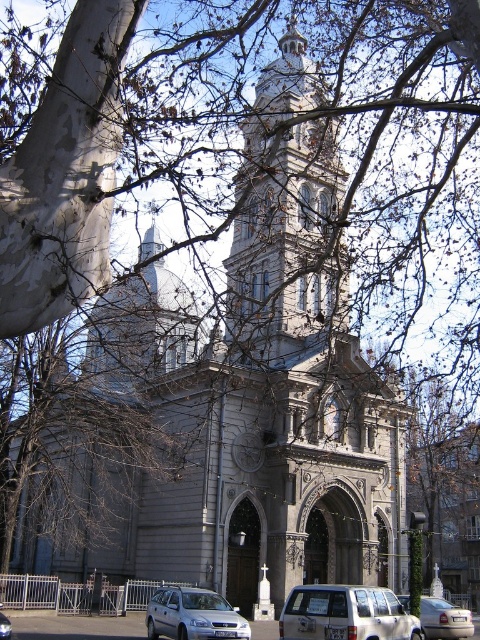
Does white matte van at lower center have a smaller size compared to satin silver wagon at lower center?

No, white matte van at lower center is not smaller than satin silver wagon at lower center.

Which is below, white matte van at lower center or satin silver wagon at lower center?

Positioned lower is white matte van at lower center.

Does point (335, 593) come behind point (156, 637)?

That is False.

Image resolution: width=480 pixels, height=640 pixels. I want to click on white matte van at lower center, so click(346, 612).

Which is below, stone tower at center or satin silver wagon at lower center?

satin silver wagon at lower center is below.

Does stone tower at center have a lesser height compared to satin silver wagon at lower center?

Incorrect, stone tower at center's height does not fall short of satin silver wagon at lower center's.

The height and width of the screenshot is (640, 480). Identify the location of stone tower at center. (286, 216).

Is point (360, 612) closer to viewer compared to point (3, 620)?

That is True.

Find the location of a particular element. This screenshot has width=480, height=640. white matte van at lower center is located at coordinates (346, 612).